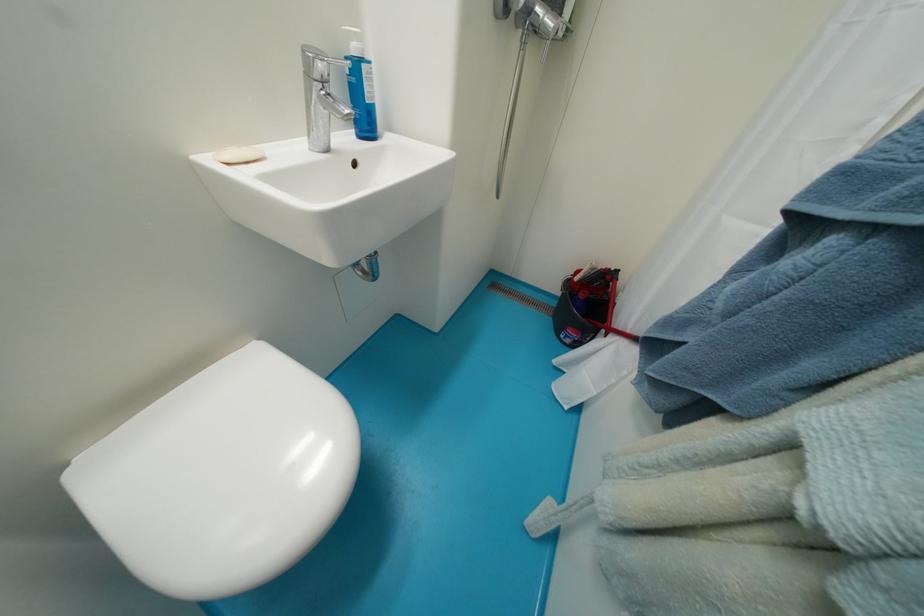
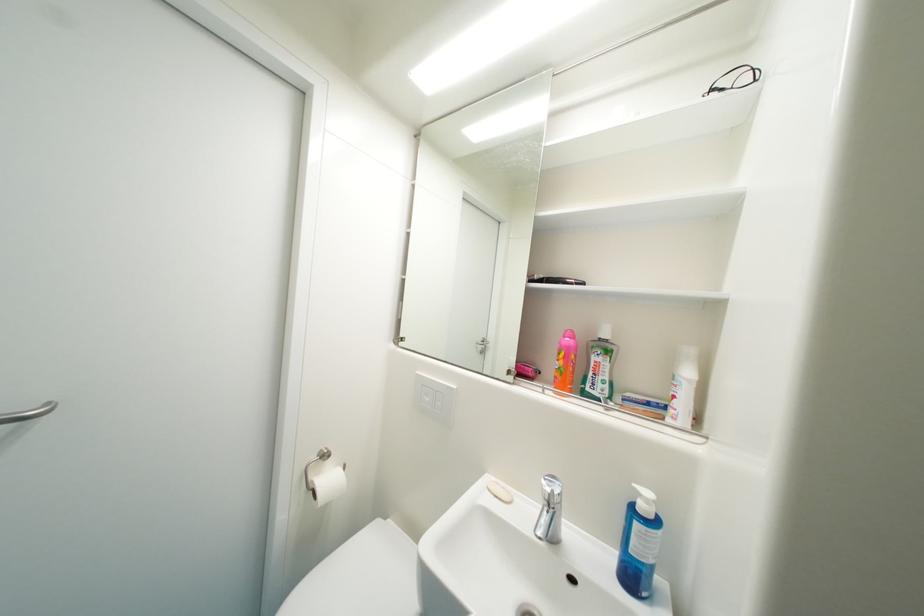
The point at (253, 166) is marked in the first image. Where is the corresponding point in the second image?

(503, 498)